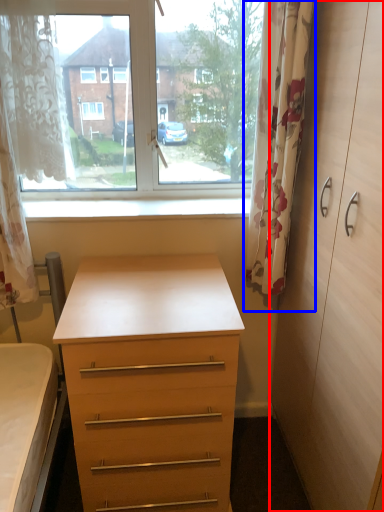
Question: Which of the following is the farthest to the observer, dresser (highlighted by a red box) or curtain (highlighted by a blue box)?

Choices:
 (A) dresser
 (B) curtain

Answer: (B)